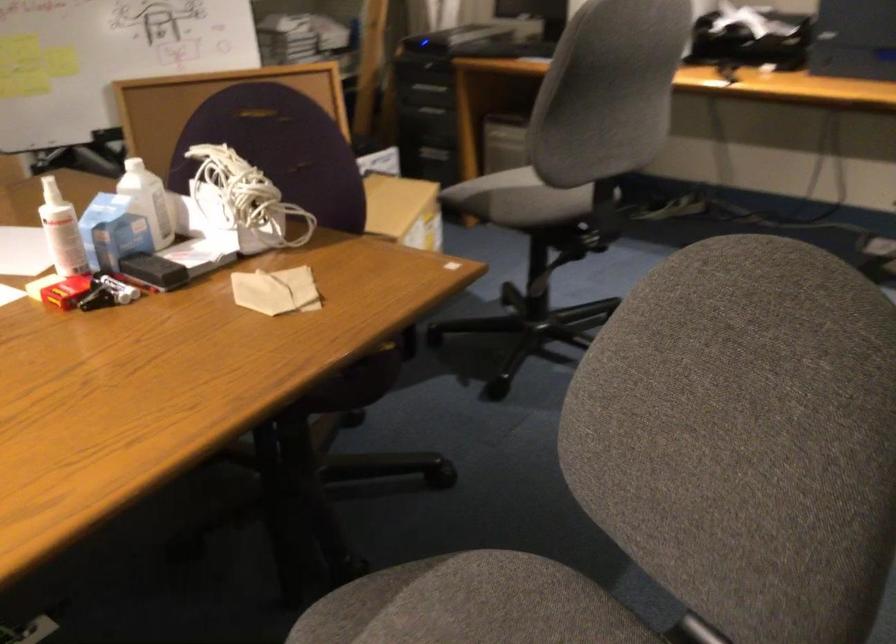
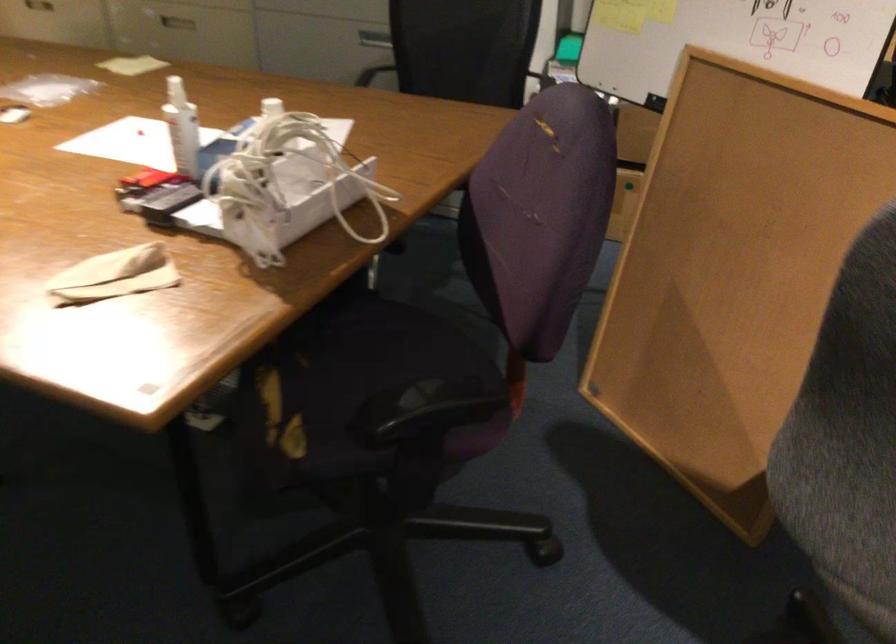
In the second image, find the point that corresponds to (214,213) in the first image.

(291, 190)